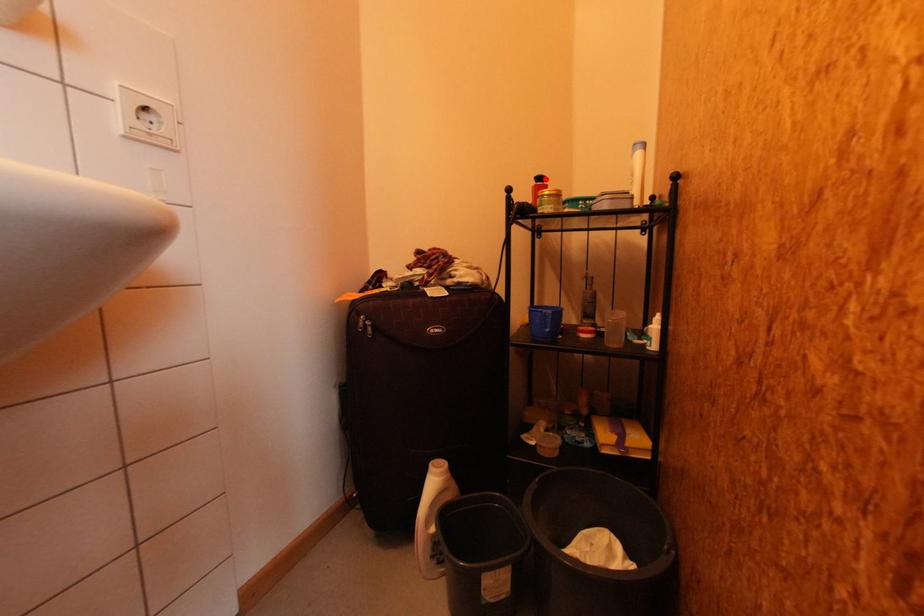
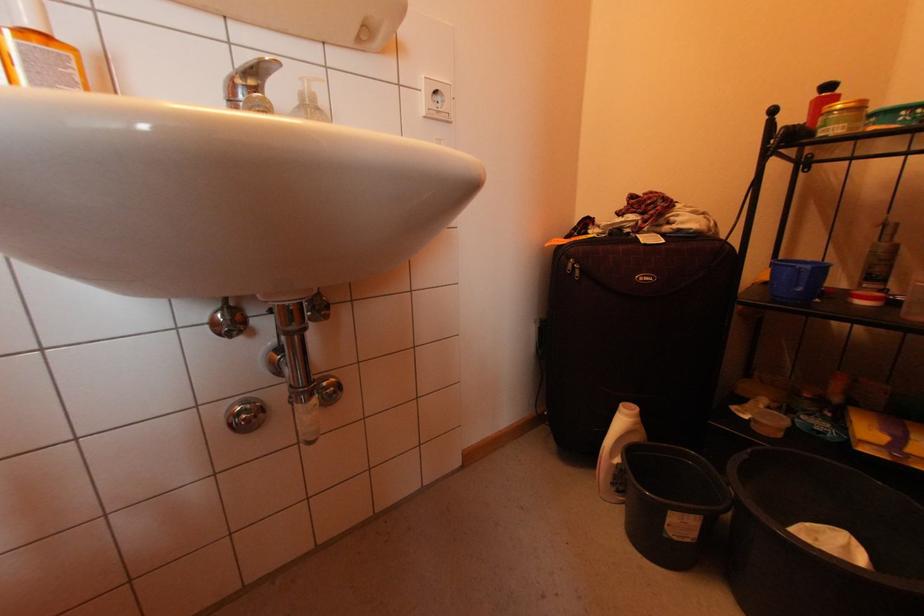
Question: I am providing you with two images of the same scene from different viewpoints. A red point is shown in image1. For the corresponding object point in image2, is it positioned nearer or farther from the camera?

Choices:
 (A) Nearer
 (B) Farther

Answer: (B)